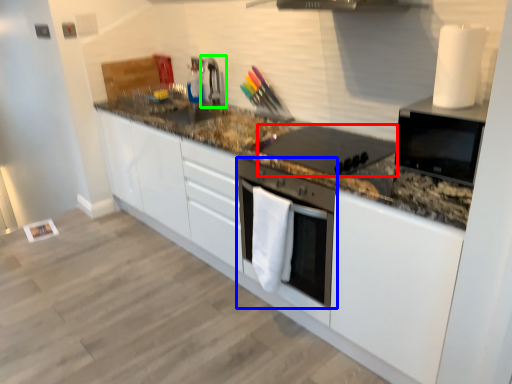
Question: Considering the real-world distances, which object is farthest from kitchen appliance (highlighted by a red box)? home appliance (highlighted by a blue box) or faucet (highlighted by a green box)?

Choices:
 (A) home appliance
 (B) faucet

Answer: (B)